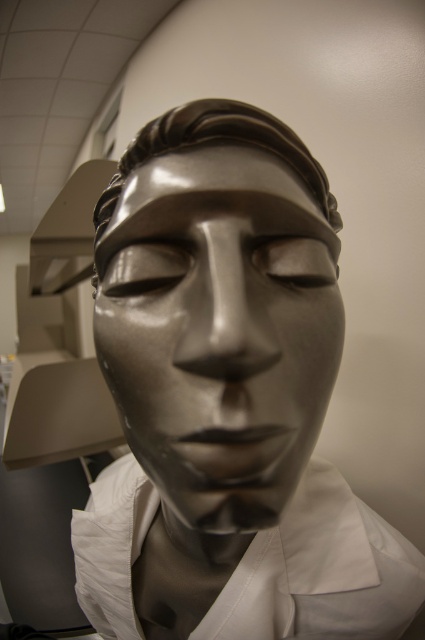
Is shiny bronze mask at center thinner than shiny bronze forehead at center?

Yes.

Is point (130, 408) positioned before point (138, 147)?

Yes, it is in front of point (138, 147).

Locate an element on the screen. The height and width of the screenshot is (640, 425). shiny bronze mask at center is located at coordinates (218, 330).

Between point (263, 189) and point (323, 563), which one is positioned behind?

Positioned behind is point (323, 563).

Can you confirm if shiny bronze mask at center is positioned to the right of white matte dress shirt at center?

Correct, you'll find shiny bronze mask at center to the right of white matte dress shirt at center.

Measure the distance between shiny bronze mask at center and camera.

A distance of 7.59 inches exists between shiny bronze mask at center and camera.

The height and width of the screenshot is (640, 425). I want to click on shiny bronze mask at center, so click(218, 330).

Between white matte dress shirt at center and shiny bronze forehead at center, which one is positioned higher?

shiny bronze forehead at center is higher up.

Can you confirm if white matte dress shirt at center is shorter than shiny bronze forehead at center?

In fact, white matte dress shirt at center may be taller than shiny bronze forehead at center.

Who is more distant from viewer, (122, 509) or (314, 182)?

Positioned behind is point (122, 509).

Identify the location of white matte dress shirt at center. This screenshot has height=640, width=425. (320, 572).